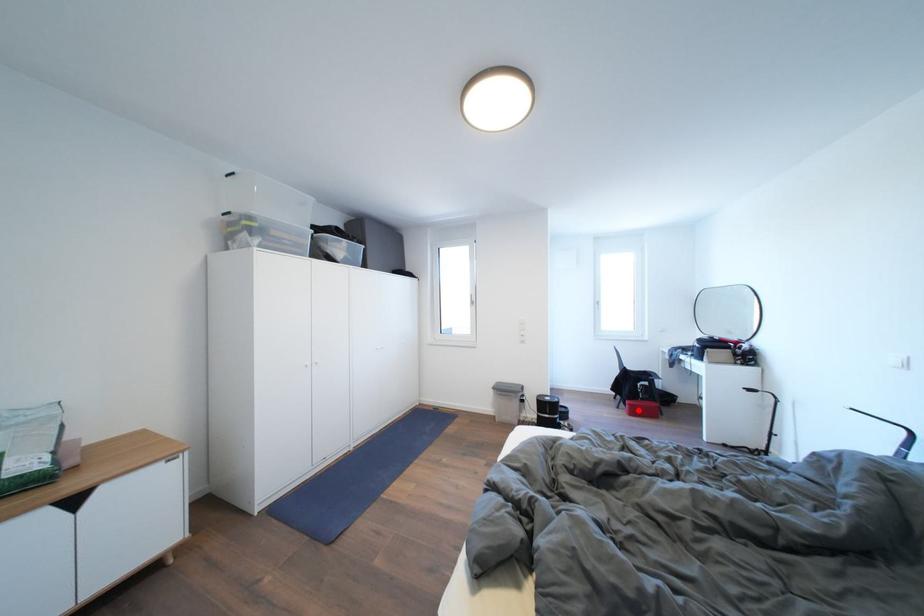
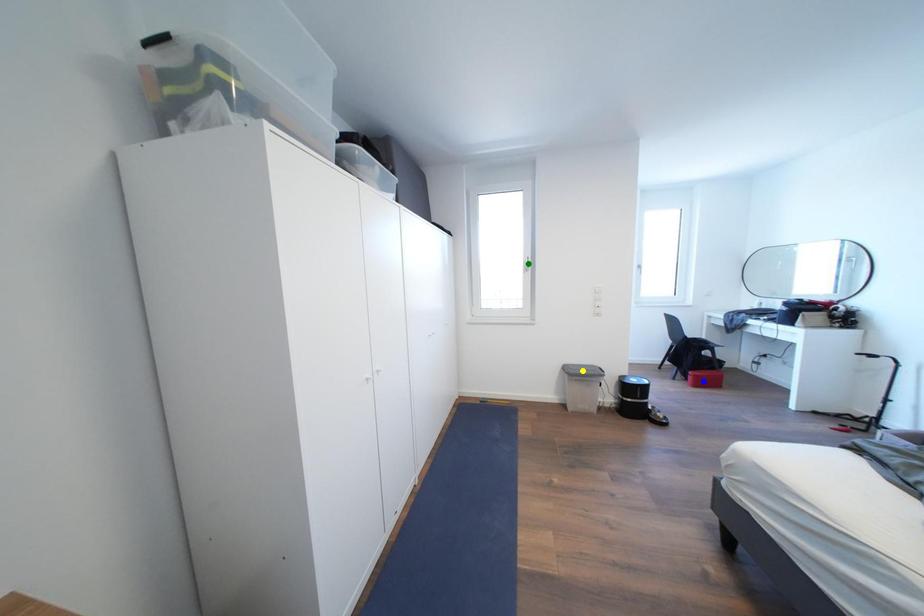
Question: I am providing you with two images of the same scene from different viewpoints. A red point is marked on the first image. You are given multiple points on the second image. Can you choose the point in image 2 that corresponds to the point in image 1?

Choices:
 (A) green point
 (B) blue point
 (C) yellow point

Answer: (B)